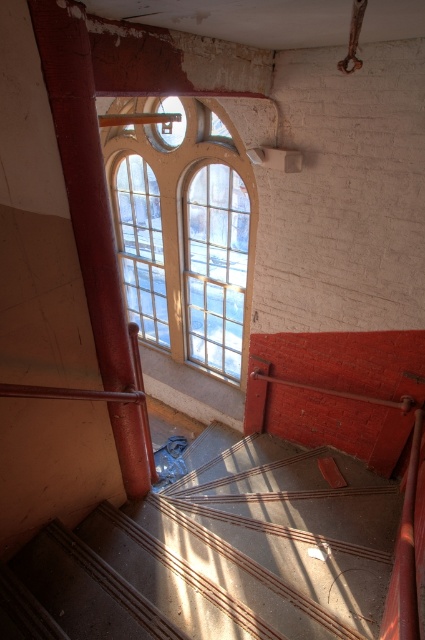
Which is in front, point (129, 621) or point (139, 234)?

Point (129, 621)

Does point (231, 524) come behind point (150, 326)?

No, it is in front of (150, 326).

Which is in front, point (280, 492) or point (221, 147)?

Positioned in front is point (280, 492).

The image size is (425, 640). Identify the location of concrete textured stairs at center. click(x=220, y=556).